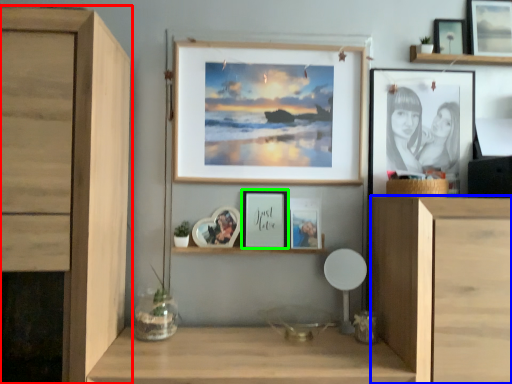
Question: Estimate the real-world distances between objects in this image. Which object is farther from cabinetry (highlighted by a red box), cabinetry (highlighted by a blue box) or picture frame (highlighted by a green box)?

Choices:
 (A) cabinetry
 (B) picture frame

Answer: (A)